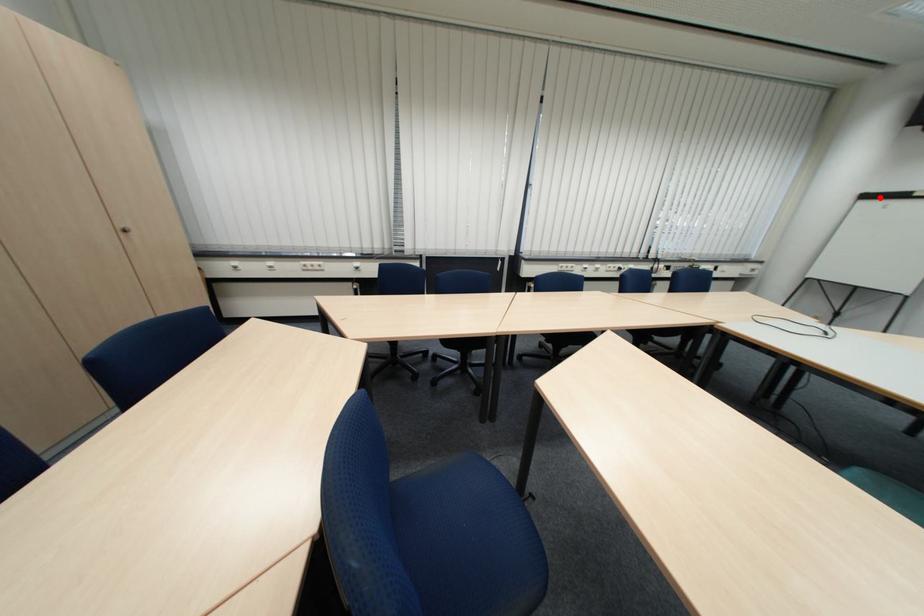
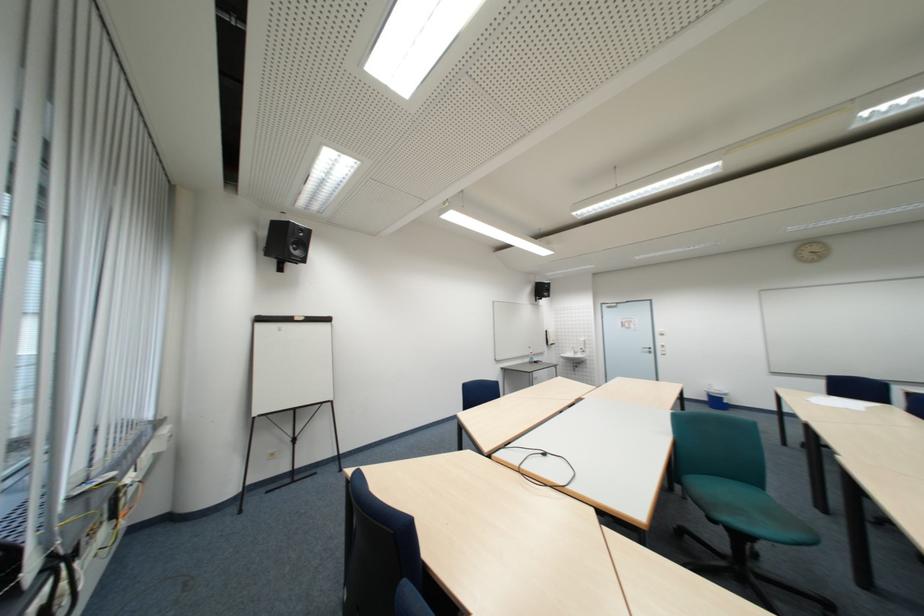
Question: I am providing you with two images of the same scene from different viewpoints. In image1, a red point is highlighted. Considering the same 3D point in image2, which of the following is correct?

Choices:
 (A) It is closer
 (B) It is farther

Answer: (A)